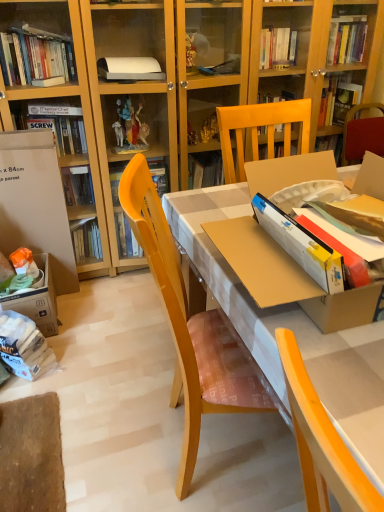
This screenshot has width=384, height=512. I want to click on white paper bag at lower left, so click(x=24, y=346).

In order to face matte yellow desk at center, should I rotate leftwards or rightwards?

Answer: To face it directly, rotate right by 1.926 degrees.

The image size is (384, 512). I want to click on white cardboard box at left, so click(x=35, y=203).

Which object is further away from the camera, white paper bag at lower left or matte yellow desk at center?

white paper bag at lower left is further from the camera.

From the image's perspective, who appears lower, white paper bag at lower left or matte yellow desk at center?

white paper bag at lower left.

From a real-world perspective, which object rests below the other?

white paper bag at lower left is physically lower.

Are white paper bag at lower left and matte yellow desk at center far apart?

That's not correct — white paper bag at lower left is a little close to matte yellow desk at center.

Based on the photo, who is shorter, matte yellow desk at center or white cardboard box at left?

white cardboard box at left is shorter.

Considering their positions, is matte yellow desk at center located in front of or behind white cardboard box at left?

In the image, matte yellow desk at center appears in front of white cardboard box at left.

Identify the location of desk on the right of white cardboard box at left. pos(288,328).

Is matte yellow desk at center facing away from white cardboard box at left?

matte yellow desk at center does not have its back to white cardboard box at left.

Are white cardboard box at left and white paper bag at lower left far apart?

No, white cardboard box at left is not far from white paper bag at lower left.

Locate an element on the screen. leftover positioned vertically above the white paper bag at lower left (from a real-world perspective) is located at coordinates (35, 203).

Is white cardboard box at left completely or partially outside of white paper bag at lower left?

white cardboard box at left is positioned outside white paper bag at lower left.

From the image's perspective, between white cardboard box at left and white paper bag at lower left, who is located below?

white paper bag at lower left appears lower in the image.

In the scene shown: How many degrees apart are the facing directions of matte yellow desk at center and white paper bag at lower left?

39.3 degrees.

Is matte yellow desk at center inside or outside of white paper bag at lower left?

matte yellow desk at center cannot be found inside white paper bag at lower left.

From the image's perspective, is matte yellow desk at center beneath white paper bag at lower left?

No.

Where is `desk in front of the white paper bag at lower left`? The image size is (384, 512). desk in front of the white paper bag at lower left is located at coordinates (288, 328).

Can you confirm if white paper bag at lower left is wider than white cardboard box at left?

Correct, the width of white paper bag at lower left exceeds that of white cardboard box at left.

From the image's perspective, is white paper bag at lower left over white cardboard box at left?

Incorrect, from the image's perspective, white paper bag at lower left is lower than white cardboard box at left.

Looking at the image, does white paper bag at lower left seem bigger or smaller compared to white cardboard box at left?

Considering their sizes, white paper bag at lower left takes up less space than white cardboard box at left.

Considering the relative sizes of white paper bag at lower left and white cardboard box at left in the image provided, is white paper bag at lower left shorter than white cardboard box at left?

Yes.

Looking at this image, considering their positions, is white cardboard box at left located in front of or behind matte yellow desk at center?

In the image, white cardboard box at left appears behind matte yellow desk at center.

Can you confirm if white cardboard box at left is bigger than matte yellow desk at center?

No.

Is white cardboard box at left to the right of matte yellow desk at center from the viewer's perspective?

No.

This screenshot has height=512, width=384. Find the location of `book lying below the matte yellow desk at center (from the image's perspective)`. book lying below the matte yellow desk at center (from the image's perspective) is located at coordinates (24, 346).

Find the location of `leftover located on the left of matte yellow desk at center`. leftover located on the left of matte yellow desk at center is located at coordinates (35, 203).

When comparing their distances from white paper bag at lower left, does matte yellow desk at center or white cardboard box at left seem closer?

white cardboard box at left lies closer to white paper bag at lower left than the other object.

When comparing their distances from matte yellow desk at center, does white paper bag at lower left or white cardboard box at left seem further?

white paper bag at lower left is further to matte yellow desk at center.

When comparing their distances from white cardboard box at left, does white paper bag at lower left or matte yellow desk at center seem closer?

Among the two, white paper bag at lower left is located nearer to white cardboard box at left.

When comparing their distances from white paper bag at lower left, does white cardboard box at left or matte yellow desk at center seem closer?

Based on the image, white cardboard box at left appears to be nearer to white paper bag at lower left.

Which object lies nearer to the anchor point white cardboard box at left, matte yellow desk at center or white paper bag at lower left?

The object closer to white cardboard box at left is white paper bag at lower left.

Based on their spatial positions, is white cardboard box at left or white paper bag at lower left further from matte yellow desk at center?

white paper bag at lower left lies further to matte yellow desk at center than the other object.

Image resolution: width=384 pixels, height=512 pixels. Find the location of `book positioned between matte yellow desk at center and white cardboard box at left from near to far`. book positioned between matte yellow desk at center and white cardboard box at left from near to far is located at coordinates (24, 346).